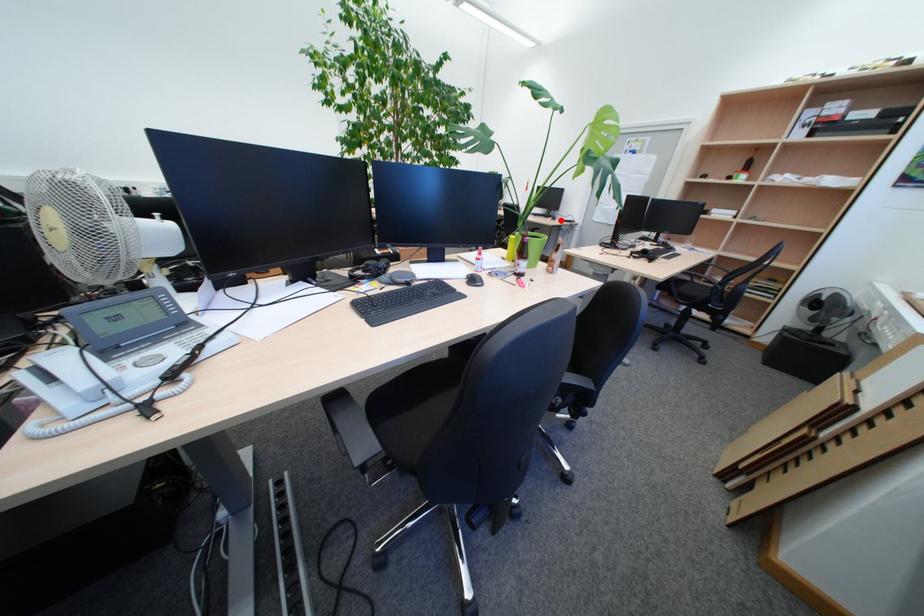
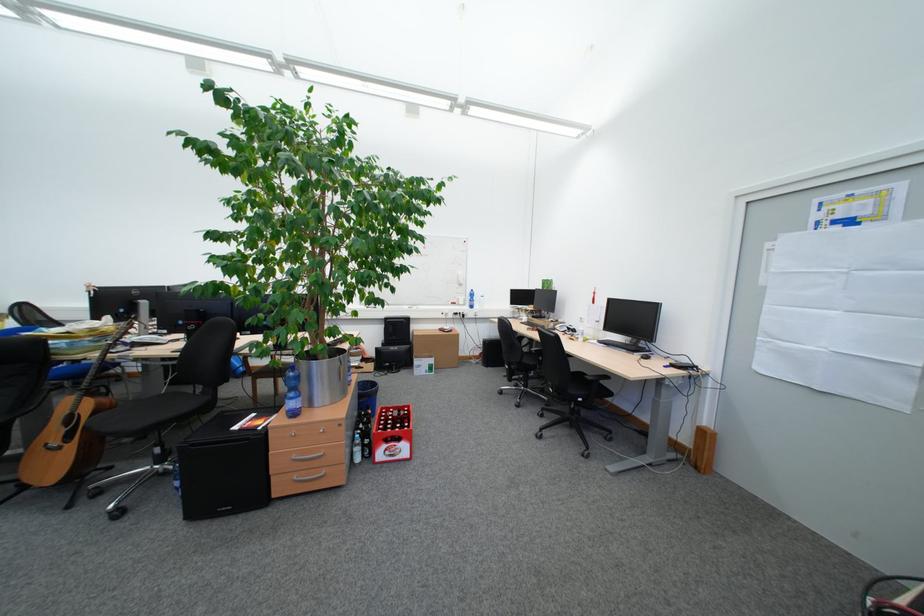
Question: I am providing you with two images of the same scene from different viewpoints. A red point is shown in image1. For the corresponding object point in image2, is it positioned nearer or farther from the camera?

Choices:
 (A) Nearer
 (B) Farther

Answer: (A)